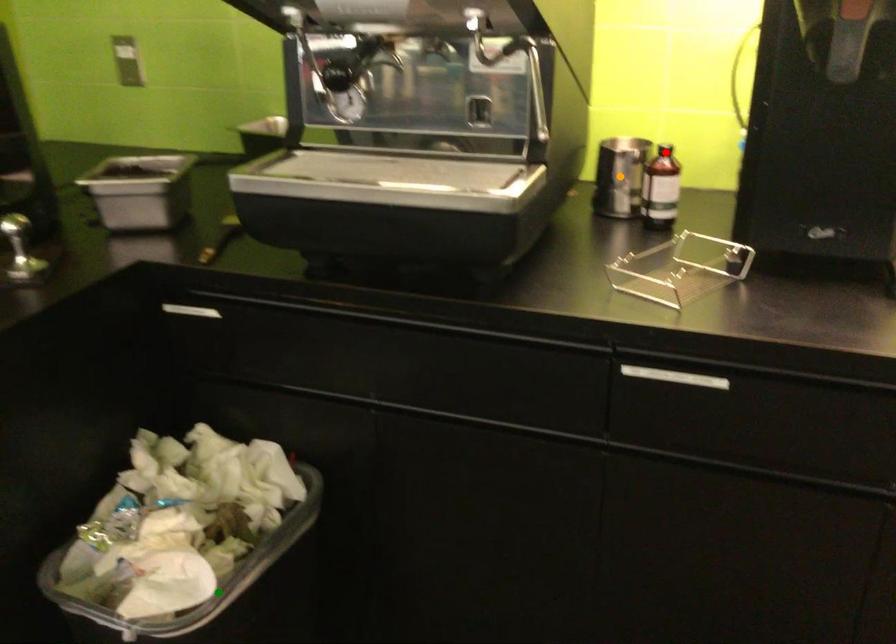
Order these from nearest to farthest:
A) green point
B) red point
C) orange point

green point, red point, orange point